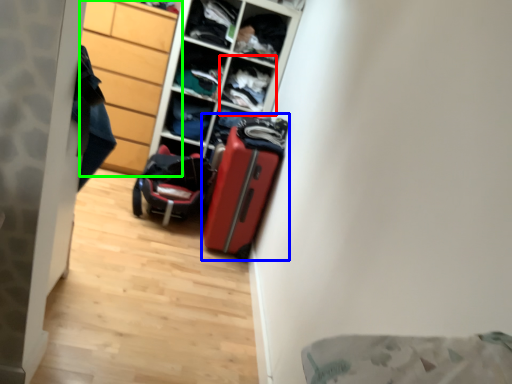
Question: Estimate the real-world distances between objects in this image. Which object is closer to cabinet (highlighted by a red box), suitcase (highlighted by a blue box) or cabinetry (highlighted by a green box)?

Choices:
 (A) suitcase
 (B) cabinetry

Answer: (B)